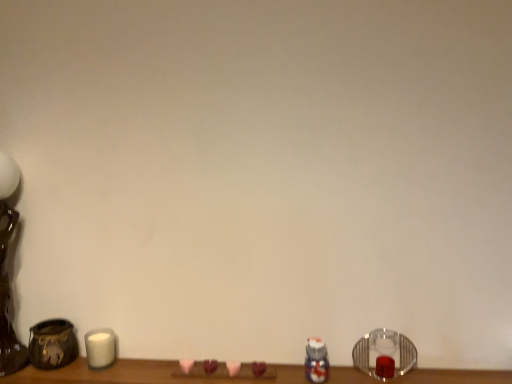
Based on the photo, measure the distance between point (405, 342) and camera.

1.09 meters.

Locate an element on the screen. The image size is (512, 384). brushed metal table lamp at left is located at coordinates (6, 273).

Based on their sizes in the image, would you say clear glass candle holder at lower right is bigger or smaller than brushed metal table lamp at left?

Considering their sizes, clear glass candle holder at lower right takes up less space than brushed metal table lamp at left.

Can you confirm if clear glass candle holder at lower right is positioned to the left of brushed metal table lamp at left?

Incorrect, clear glass candle holder at lower right is not on the left side of brushed metal table lamp at left.

From the image's perspective, relative to brushed metal table lamp at left, is clear glass candle holder at lower right above or below?

From the image's perspective, clear glass candle holder at lower right appears below brushed metal table lamp at left.

Is translucent plastic toy at lower right at the left side of brushed metal table lamp at left?

Incorrect, translucent plastic toy at lower right is not on the left side of brushed metal table lamp at left.

Which object is more forward, translucent plastic toy at lower right or brushed metal table lamp at left?

brushed metal table lamp at left is in front.

From the picture: From a real-world perspective, which object stands above the other?

From a 3D spatial view, brushed metal table lamp at left is above.

Is translucent plastic toy at lower right wider than brushed metal table lamp at left?

In fact, translucent plastic toy at lower right might be narrower than brushed metal table lamp at left.

Is white matte candle at lower left positioned with its back to clear glass candle holder at lower right?

No, white matte candle at lower left's orientation is not away from clear glass candle holder at lower right.

From a real-world perspective, relative to clear glass candle holder at lower right, is white matte candle at lower left vertically above or below?

Clearly, from a real-world perspective, white matte candle at lower left is below clear glass candle holder at lower right.

Considering the sizes of objects white matte candle at lower left and clear glass candle holder at lower right in the image provided, who is taller, white matte candle at lower left or clear glass candle holder at lower right?

Standing taller between the two is clear glass candle holder at lower right.

Looking at this image, is matte brown vase at left positioned in front of white matte candle at lower left?

Yes.

Which is less distant, (32, 348) or (103, 331)?

The point (32, 348) is in front.

From a real-world perspective, who is located higher, matte brown vase at left or white matte candle at lower left?

In real-world perspective, matte brown vase at left is above.

Where is `candle below the matte brown vase at left (from the image's perspective)`? Image resolution: width=512 pixels, height=384 pixels. candle below the matte brown vase at left (from the image's perspective) is located at coordinates (100, 348).

Is white matte candle at lower left next to translucent plastic toy at lower right and touching it?

They are not placed beside each other.

From the image's perspective, would you say white matte candle at lower left is shown under translucent plastic toy at lower right?

Indeed, from the image's perspective, white matte candle at lower left is shown beneath translucent plastic toy at lower right.

Consider the image. Is white matte candle at lower left at the right side of translucent plastic toy at lower right?

In fact, white matte candle at lower left is to the left of translucent plastic toy at lower right.

Would you say white matte candle at lower left is inside or outside translucent plastic toy at lower right?

white matte candle at lower left is not enclosed by translucent plastic toy at lower right.

Could you tell me if matte brown vase at left is turned towards translucent plastic toy at lower right?

No.

Is matte brown vase at left wider or thinner than translucent plastic toy at lower right?

In the image, matte brown vase at left appears to be wider than translucent plastic toy at lower right.

Is translucent plastic toy at lower right inside matte brown vase at left?

No, translucent plastic toy at lower right is not a part of matte brown vase at left.

From the picture: Would you say matte brown vase at left is a long distance from translucent plastic toy at lower right?

No.

Between point (369, 360) and point (110, 347), which one is positioned behind?

The point (110, 347) is behind.

Is clear glass candle holder at lower right with white matte candle at lower left?

No, clear glass candle holder at lower right is not touching white matte candle at lower left.

Is clear glass candle holder at lower right oriented away from white matte candle at lower left?

No, clear glass candle holder at lower right is not facing the opposite direction of white matte candle at lower left.

Where is `candle holder below the brushed metal table lamp at left (from a real-world perspective)`? Image resolution: width=512 pixels, height=384 pixels. candle holder below the brushed metal table lamp at left (from a real-world perspective) is located at coordinates (384, 354).

I want to click on table lamp above the translucent plastic toy at lower right (from the image's perspective), so click(6, 273).

Considering their positions, is brushed metal table lamp at left positioned further to translucent plastic toy at lower right than white matte candle at lower left?

Based on the image, brushed metal table lamp at left appears to be further to translucent plastic toy at lower right.

From the image, which object appears to be farther from brushed metal table lamp at left, translucent plastic toy at lower right or white matte candle at lower left?

Among the two, translucent plastic toy at lower right is located further to brushed metal table lamp at left.

When comparing their distances from clear glass candle holder at lower right, does translucent plastic toy at lower right or matte brown vase at left seem closer?

translucent plastic toy at lower right is closer to clear glass candle holder at lower right.

Based on their spatial positions, is translucent plastic toy at lower right or clear glass candle holder at lower right further from matte brown vase at left?

Among the two, clear glass candle holder at lower right is located further to matte brown vase at left.

Considering their positions, is brushed metal table lamp at left positioned closer to matte brown vase at left than white matte candle at lower left?

Among the two, white matte candle at lower left is located nearer to matte brown vase at left.

Estimate the real-world distances between objects in this image. Which object is further from translucent plastic toy at lower right, matte brown vase at left or clear glass candle holder at lower right?

matte brown vase at left is positioned further to the anchor translucent plastic toy at lower right.

Considering their positions, is brushed metal table lamp at left positioned closer to clear glass candle holder at lower right than white matte candle at lower left?

The object closer to clear glass candle holder at lower right is white matte candle at lower left.

From the image, which object appears to be nearer to clear glass candle holder at lower right, matte brown vase at left or brushed metal table lamp at left?

The object closer to clear glass candle holder at lower right is matte brown vase at left.

This screenshot has width=512, height=384. What are the coordinates of `toy situated between white matte candle at lower left and clear glass candle holder at lower right from left to right` in the screenshot? It's located at (316, 361).

Find the location of a particular element. pottery between brushed metal table lamp at left and translucent plastic toy at lower right from left to right is located at coordinates (52, 344).

The width and height of the screenshot is (512, 384). Identify the location of candle located between brushed metal table lamp at left and clear glass candle holder at lower right in the left-right direction. click(x=100, y=348).

Image resolution: width=512 pixels, height=384 pixels. I want to click on candle situated between brushed metal table lamp at left and translucent plastic toy at lower right from left to right, so [x=100, y=348].